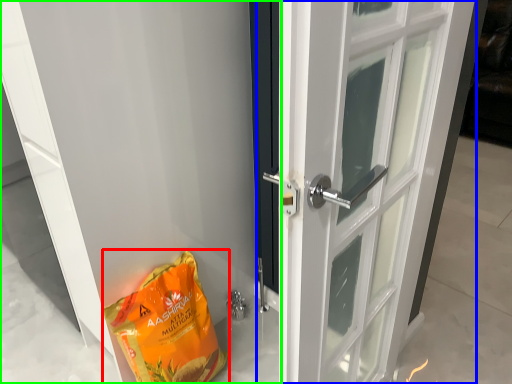
Question: Which object is the farthest from grocery bag (highlighted by a red box)? Choose among these: door (highlighted by a blue box) or door (highlighted by a green box).

Choices:
 (A) door
 (B) door

Answer: (A)